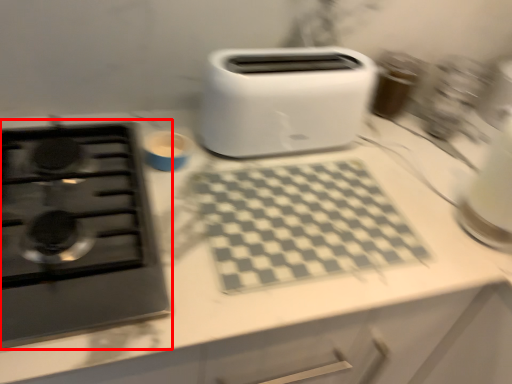
Question: From the image's perspective, considering the relative positions of gas stove (annotated by the red box) and toaster in the image provided, where is gas stove (annotated by the red box) located with respect to the staircase?

Choices:
 (A) above
 (B) below

Answer: (B)